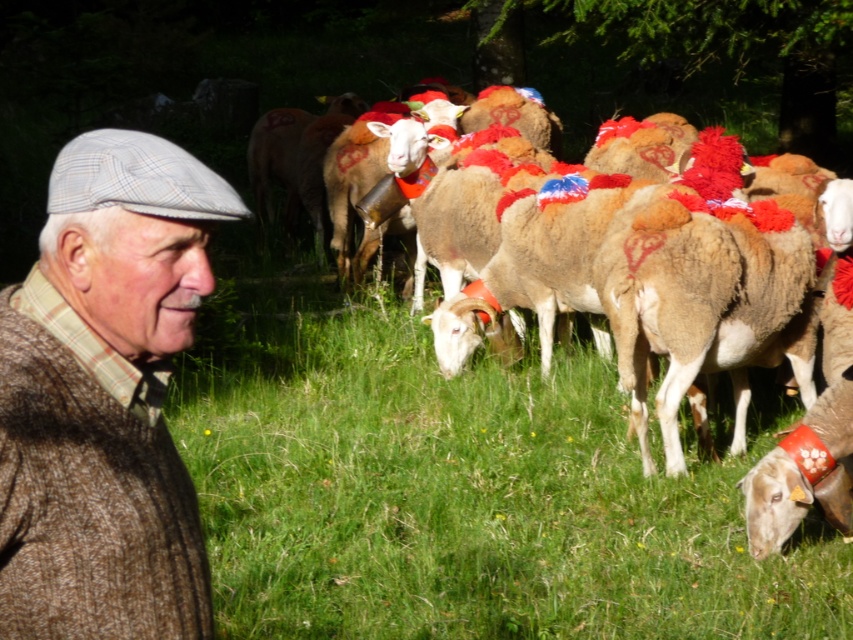
Who is positioned more to the left, brown woolen sweater at left or brown woolen sheep at center?

brown woolen sweater at left

Which is more to the right, brown woolen sweater at left or brown woolen sheep at center?

brown woolen sheep at center

Does point (86, 544) come closer to viewer compared to point (781, 257)?

Yes, point (86, 544) is closer to viewer.

Image resolution: width=853 pixels, height=640 pixels. I want to click on brown woolen sweater at left, so click(x=103, y=400).